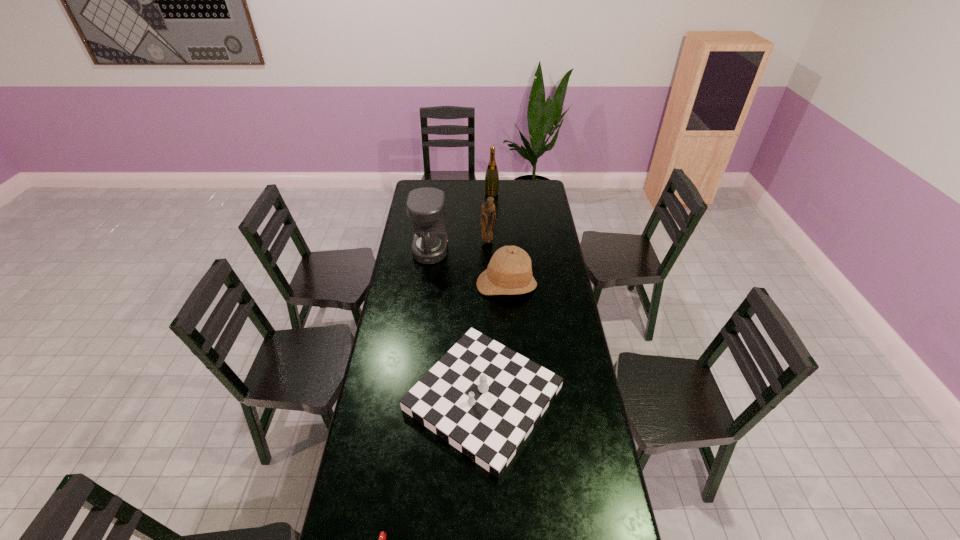
Locate an element on the screen. unoccupied position between the farthest object and the coffee maker is located at coordinates (461, 222).

Locate an element on the screen. empty space between the third nearest object and the wine bottle is located at coordinates (499, 239).

Where is `empty location between the coffee maker and the fifth farthest object`? The width and height of the screenshot is (960, 540). empty location between the coffee maker and the fifth farthest object is located at coordinates (457, 325).

This screenshot has width=960, height=540. I want to click on unoccupied position between the second shortest object and the figurine, so click(486, 320).

Choose which object is the second nearest neighbor to the farthest object. Please provide its 2D coordinates. Your answer should be formatted as a tuple, i.e. [(x, y)], where the tuple contains the x and y coordinates of a point satisfying the conditions above.

[(425, 206)]

Locate which object ranks third in proximity to the farthest object. Please provide its 2D coordinates. Your answer should be formatted as a tuple, i.e. [(x, y)], where the tuple contains the x and y coordinates of a point satisfying the conditions above.

[(509, 272)]

Where is `vacant area in the image that satisfies the following two spatial constraints: 1. on the button side of the coffee maker; 2. on the right side of the second nearest object`? This screenshot has height=540, width=960. vacant area in the image that satisfies the following two spatial constraints: 1. on the button side of the coffee maker; 2. on the right side of the second nearest object is located at coordinates 411,398.

The height and width of the screenshot is (540, 960). What are the coordinates of `free spot that satisfies the following two spatial constraints: 1. on the front-facing side of the wine bottle; 2. on the button side of the coffee maker` in the screenshot? It's located at (493, 251).